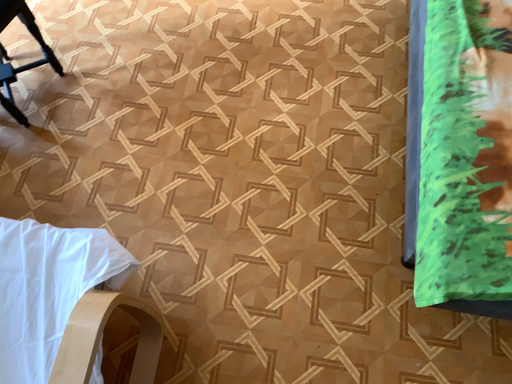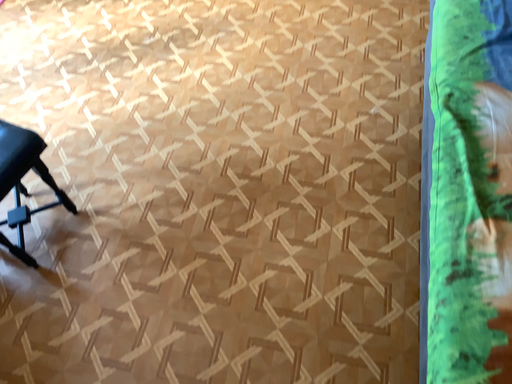
Question: How did the camera likely rotate when shooting the video?

Choices:
 (A) rotated downward
 (B) rotated upward

Answer: (B)